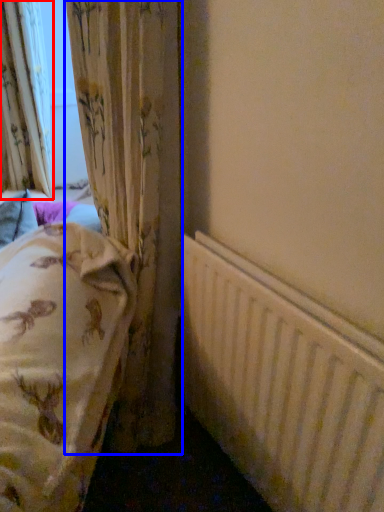
Question: Which object is closer to the camera taking this photo, curtain (highlighted by a red box) or curtain (highlighted by a blue box)?

Choices:
 (A) curtain
 (B) curtain

Answer: (B)